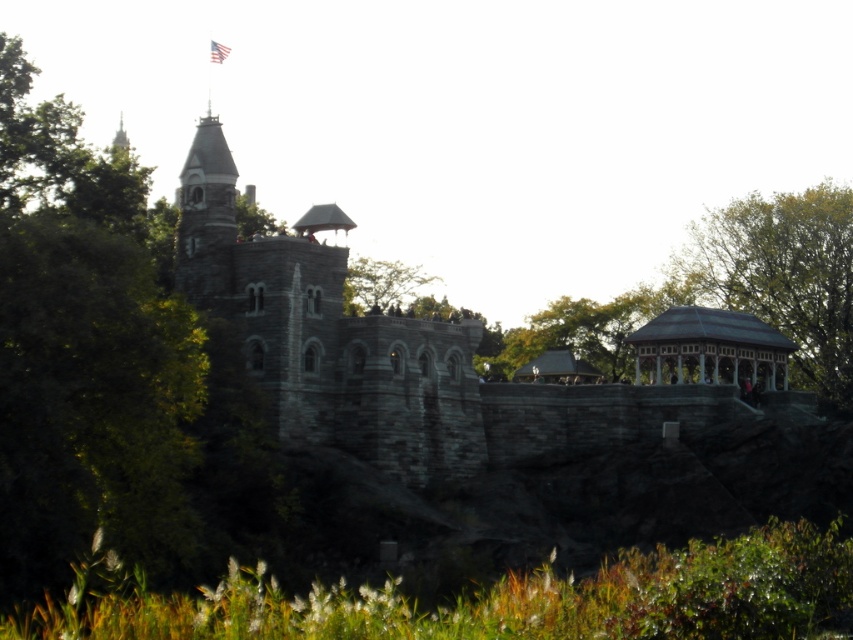
This screenshot has width=853, height=640. Find the location of `stone tower at upper left`. stone tower at upper left is located at coordinates (206, 216).

Which is behind, point (189, 211) or point (218, 44)?

The point (218, 44) is behind.

Is point (221, 225) closer to camera compared to point (212, 60)?

That is True.

This screenshot has width=853, height=640. What are the coordinates of `stone tower at upper left` in the screenshot? It's located at (x=206, y=216).

Can you confirm if wooden gazebo at right is positioned to the right of green leafy tree at upper center?

Correct, you'll find wooden gazebo at right to the right of green leafy tree at upper center.

From the picture: Does wooden gazebo at right have a greater height compared to green leafy tree at upper center?

Correct, wooden gazebo at right is much taller as green leafy tree at upper center.

The width and height of the screenshot is (853, 640). Identify the location of wooden gazebo at right. (711, 348).

At what (x,y) coordinates should I click in order to perform the action: click on wooden gazebo at right. Please return your answer as a coordinate pair (x, y). Image resolution: width=853 pixels, height=640 pixels. Looking at the image, I should click on (711, 348).

Can you confirm if gray stone castle at center is shorter than green leafy tree at upper center?

In fact, gray stone castle at center may be taller than green leafy tree at upper center.

Who is positioned more to the left, gray stone castle at center or green leafy tree at upper center?

Positioned to the left is green leafy tree at upper center.

The image size is (853, 640). In order to click on gray stone castle at center in this screenshot , I will do `click(434, 353)`.